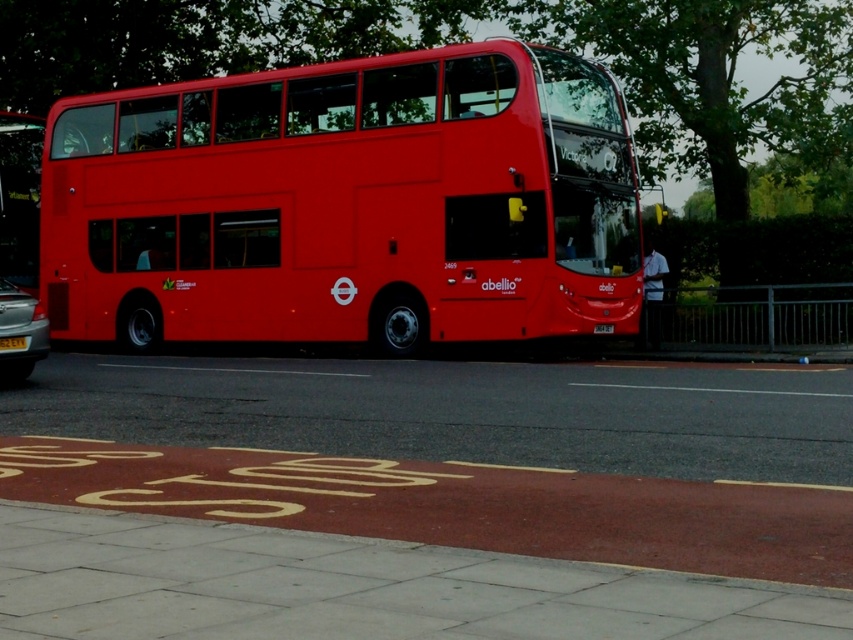
You are a GUI agent. You are given a task and a screenshot of the screen. Output one action in this format:
    pyautogui.click(x=<x>, y=<y>)
    Task: Click on the shiny red bus at center
    
    Given the screenshot: What is the action you would take?
    pyautogui.click(x=346, y=204)

Which is behind, point (161, 147) or point (0, 348)?

Point (161, 147)

Find the location of a particular element. shiny red bus at center is located at coordinates (346, 204).

Does metallic silver car at left have a greater height compared to yellow matte license plate at center?

Yes.

Does point (28, 326) come behind point (22, 342)?

Yes, point (28, 326) is behind point (22, 342).

I want to click on metallic silver car at left, so click(x=20, y=332).

Between point (70, 156) and point (35, 332), which one is positioned behind?

Positioned behind is point (70, 156).

Does shiny red bus at center appear on the right side of metallic silver car at left?

Yes, shiny red bus at center is to the right of metallic silver car at left.

Between point (187, 262) and point (30, 305), which one is positioned behind?

Point (187, 262)

Image resolution: width=853 pixels, height=640 pixels. I want to click on shiny red bus at center, so click(x=346, y=204).